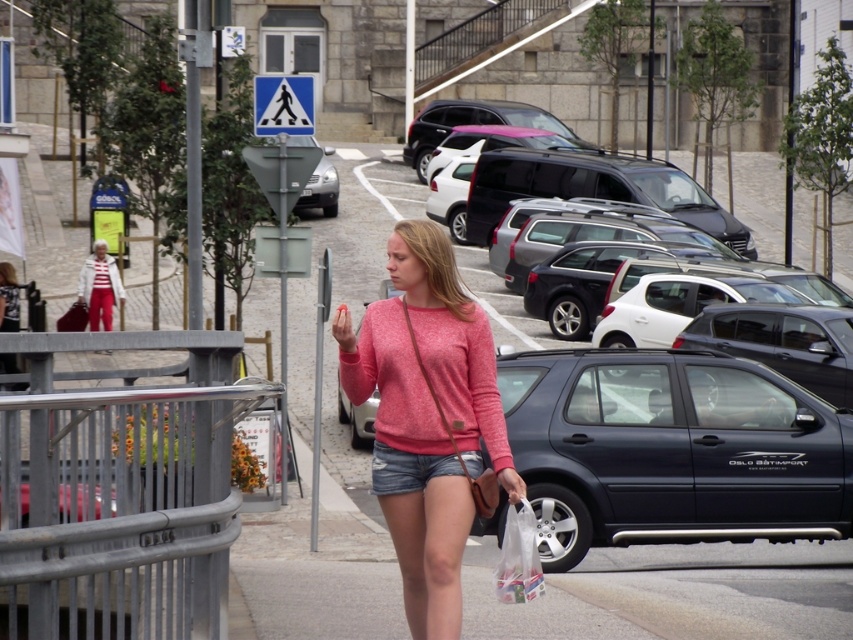
Question: Which of the following is the farthest from the observer?

Choices:
 (A) (456, 589)
 (B) (582, 378)

Answer: (B)

Question: Is matte black suv at center wider than matte pink sweater at center?

Choices:
 (A) no
 (B) yes

Answer: (B)

Question: Which point is closer to the camera?

Choices:
 (A) matte black suv at center
 (B) matte pink sweater at center

Answer: (B)

Question: Which point is farther from the camera taking this photo?

Choices:
 (A) (505, 538)
 (B) (670, 364)
 (C) (445, 522)

Answer: (B)

Question: Does matte pink sweater at center appear on the right side of translucent plastic bag at center?

Choices:
 (A) no
 (B) yes

Answer: (A)

Question: Can you confirm if matte black suv at center is bigger than matte pink sweater at center?

Choices:
 (A) yes
 (B) no

Answer: (A)